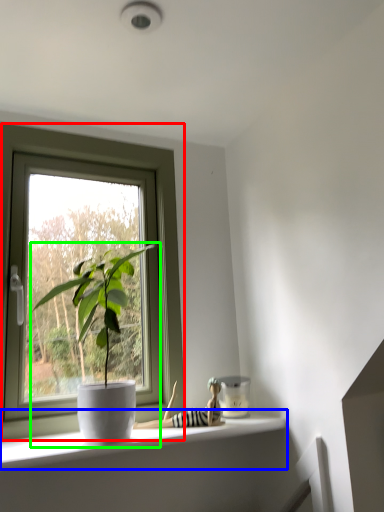
Question: Which is farther away from window (highlighted by a red box)? window sill (highlighted by a blue box) or houseplant (highlighted by a green box)?

Choices:
 (A) window sill
 (B) houseplant

Answer: (A)